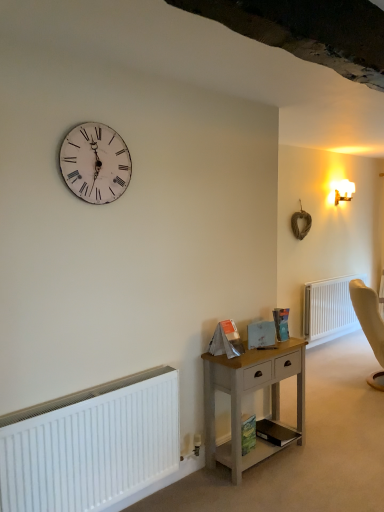
Where is `empty space that is in between light wood nightstand at lower center and black matte book at lower center, marked as the 3th book in a top-to-bottom arrangement`? empty space that is in between light wood nightstand at lower center and black matte book at lower center, marked as the 3th book in a top-to-bottom arrangement is located at coordinates (271, 466).